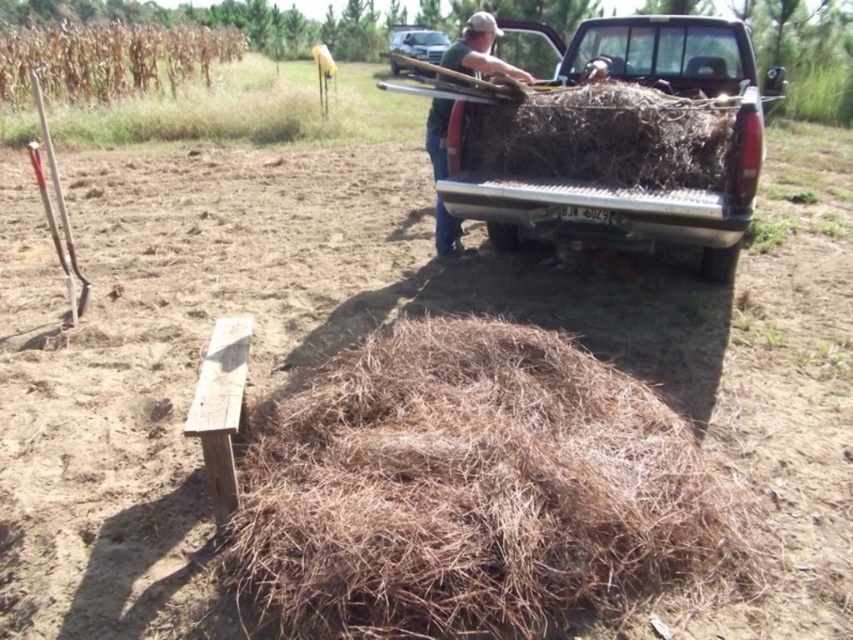
Question: Is metallic silver truck at upper right to the left of green cotton shirt at upper center from the viewer's perspective?

Choices:
 (A) yes
 (B) no

Answer: (B)

Question: Which of these objects is positioned farthest from the brown dry hay at center?

Choices:
 (A) green cotton shirt at upper center
 (B) metallic silver truck at upper right
 (C) brown dry hay at rear

Answer: (A)

Question: Which point is farther from the camera taking this photo?

Choices:
 (A) (45, 33)
 (B) (651, 176)
 (C) (434, 561)

Answer: (A)

Question: Which point is farther to the camera?

Choices:
 (A) click(x=438, y=248)
 (B) click(x=648, y=100)

Answer: (A)

Question: Is brown dry hay at rear positioned behind green cotton shirt at upper center?

Choices:
 (A) no
 (B) yes

Answer: (A)

Question: Does brown dry hay at center lie in front of brown dry hay at upper left?

Choices:
 (A) yes
 (B) no

Answer: (A)